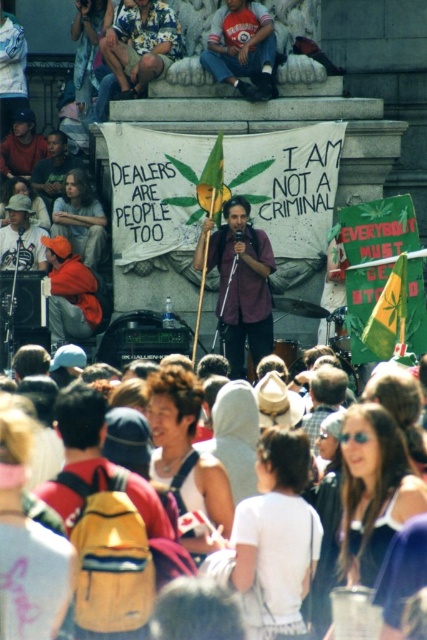
Who is more forward, (347, 456) or (274, 268)?

Point (347, 456) is more forward.

Measure the distance between point (386, 445) and camera.

The distance of point (386, 445) from camera is 61.91 meters.

I want to click on white cotton hoodie at center, so click(x=388, y=444).

Locate an element on the screen. The width and height of the screenshot is (427, 640). white cotton hoodie at center is located at coordinates (388, 444).

Can you confirm if white cotton hoodie at center is taller than denim jeans at upper center?

Yes, white cotton hoodie at center is taller than denim jeans at upper center.

Is white cotton hoodie at center closer to camera compared to denim jeans at upper center?

Yes, white cotton hoodie at center is closer to the viewer.

Between point (160, 490) and point (221, 54), which one is positioned behind?

The point (221, 54) is more distant.

Locate an element on the screen. This screenshot has width=427, height=640. white cotton hoodie at center is located at coordinates (388, 444).

Is matte purple shirt at center wider than denim jeans at upper center?

No, matte purple shirt at center is not wider than denim jeans at upper center.

Between matte purple shirt at center and denim jeans at upper center, which one is positioned higher?

Positioned higher is denim jeans at upper center.

The width and height of the screenshot is (427, 640). Find the location of `matte purple shirt at center`. matte purple shirt at center is located at coordinates (240, 282).